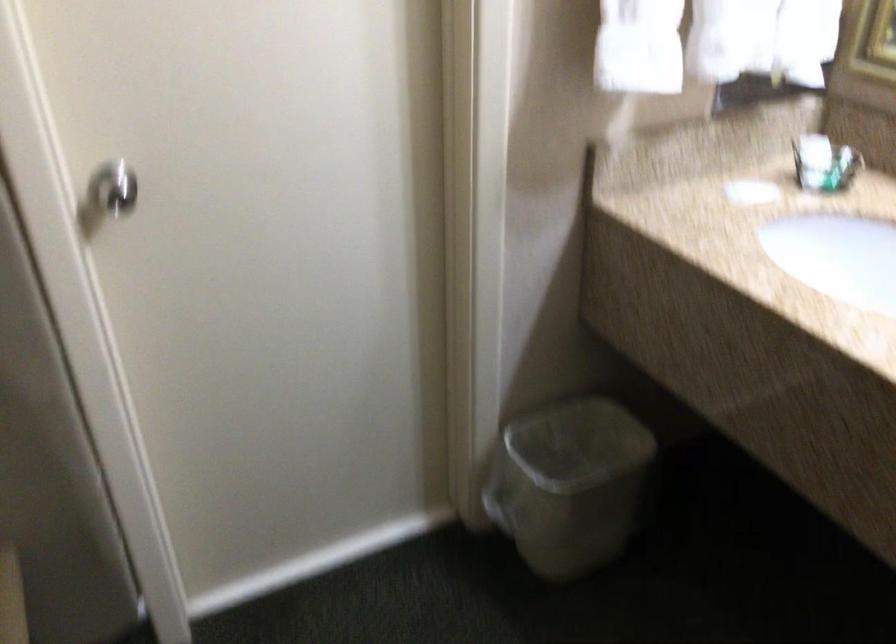
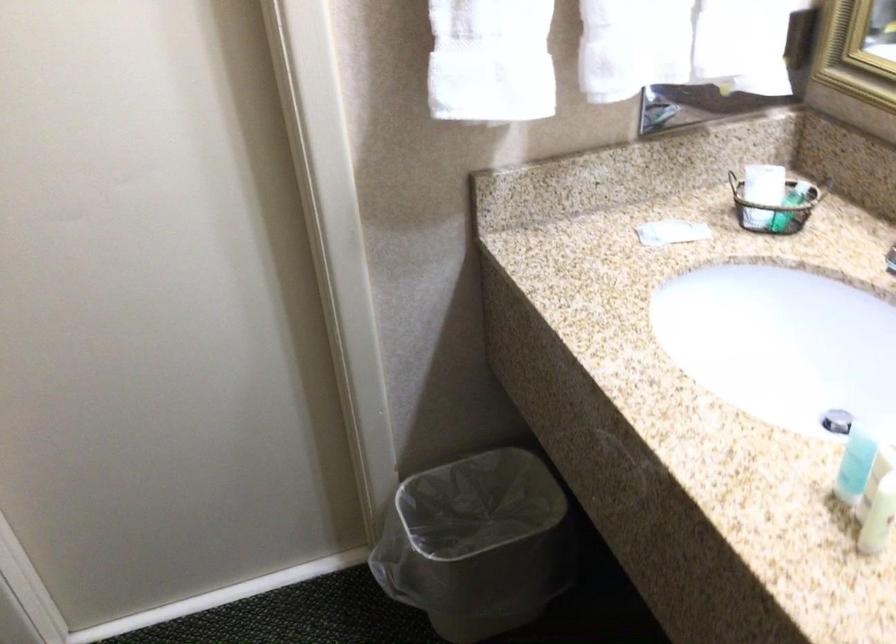
Question: How did the camera likely rotate?

Choices:
 (A) Left
 (B) Right
 (C) Up
 (D) Down

Answer: (A)